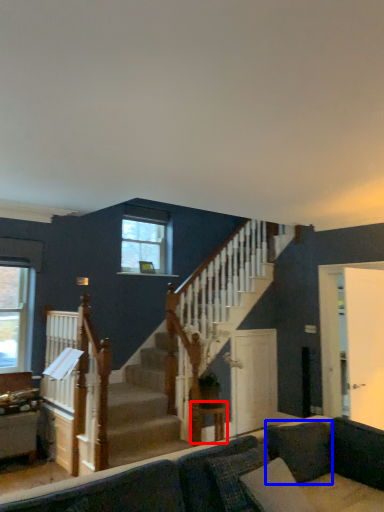
Question: Which point is closer to the camera, table (highlighted by a red box) or pillow (highlighted by a blue box)?

Choices:
 (A) table
 (B) pillow

Answer: (B)